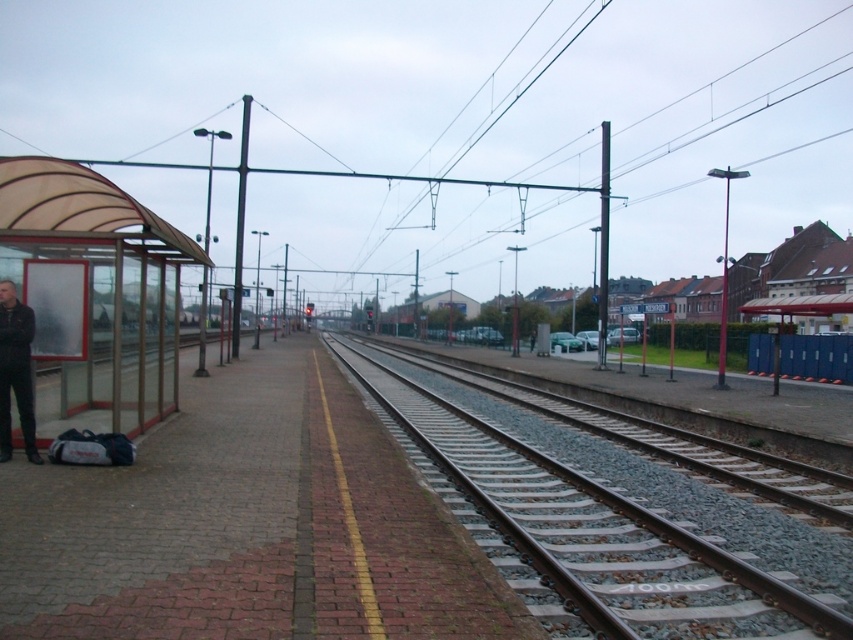
This screenshot has width=853, height=640. I want to click on translucent plastic bus stop at left, so click(x=94, y=294).

Who is more forward, (123,250) or (9,410)?

Point (9,410) is in front.

Which is in front, point (123, 349) or point (0, 444)?

Point (0, 444) is in front.

The image size is (853, 640). In order to click on translucent plastic bus stop at left in this screenshot , I will do `click(94, 294)`.

Between point (607, 544) and point (16, 340), which one is positioned in front?

Positioned in front is point (16, 340).

Is point (630, 636) less distant than point (13, 385)?

Yes, it is.

Where is `smooth metal tracks at center`? Image resolution: width=853 pixels, height=640 pixels. smooth metal tracks at center is located at coordinates (595, 532).

Where is `smooth metal tracks at center`? The image size is (853, 640). smooth metal tracks at center is located at coordinates (595, 532).

Between point (653, 540) and point (136, 346), which one is positioned behind?

Point (136, 346)

The width and height of the screenshot is (853, 640). In order to click on smooth metal tracks at center in this screenshot , I will do pos(595,532).